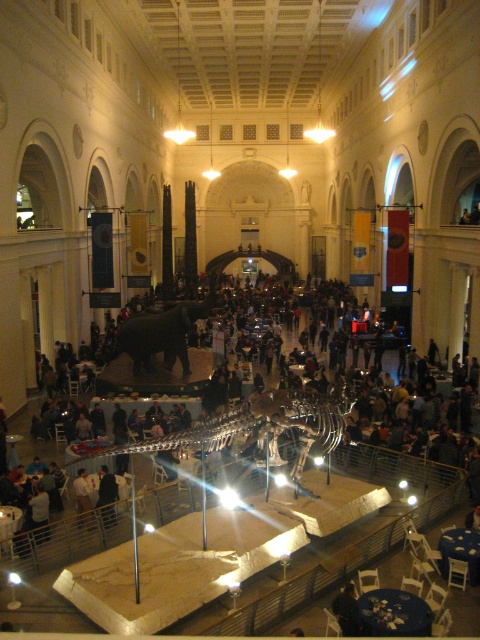
Question: Which of these objects is positioned farthest from the shiny metallic dinosaur skeleton at center?

Choices:
 (A) shiny black elephant at center
 (B) dark blue fabric at center

Answer: (B)

Question: Which of these objects is positioned farthest from the shiny black elephant at center?

Choices:
 (A) shiny metallic dinosaur skeleton at center
 (B) dark blue fabric at center

Answer: (B)

Question: Can you confirm if shiny metallic dinosaur skeleton at center is positioned below dark blue fabric at center?

Choices:
 (A) no
 (B) yes

Answer: (A)

Question: Can you confirm if shiny metallic dinosaur skeleton at center is wider than shiny black elephant at center?

Choices:
 (A) yes
 (B) no

Answer: (A)

Question: Can you confirm if shiny metallic dinosaur skeleton at center is bigger than dark blue fabric at center?

Choices:
 (A) yes
 (B) no

Answer: (A)

Question: Estimate the real-world distances between objects in this image. Which object is farther from the shiny black elephant at center?

Choices:
 (A) shiny metallic dinosaur skeleton at center
 (B) dark blue fabric at center

Answer: (B)